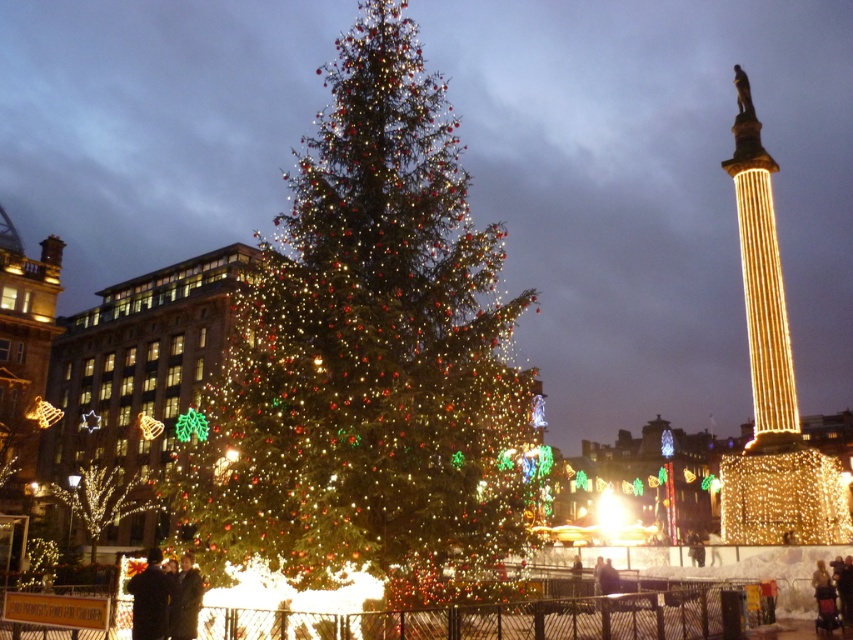
Describe the element at coordinates (366, 353) in the screenshot. I see `green matte christmas tree at center` at that location.

What do you see at coordinates (366, 353) in the screenshot? This screenshot has height=640, width=853. I see `green matte christmas tree at center` at bounding box center [366, 353].

You are a GUI agent. You are given a task and a screenshot of the screen. Output one action in this format:
    pyautogui.click(x=<x>, y=<y>)
    Task: Click on the green matte christmas tree at center
    This screenshot has height=640, width=853.
    Given the screenshot: What is the action you would take?
    pyautogui.click(x=366, y=353)

In the scene shown: Does green matte christmas tree at center have a greater height compared to dark brown coat at lower center?

Yes.

Based on the photo, can you confirm if green matte christmas tree at center is smaller than dark brown coat at lower center?

No, green matte christmas tree at center is not smaller than dark brown coat at lower center.

Is point (181, 516) positioned in front of point (192, 584)?

No, (181, 516) is further to viewer.

You are a GUI agent. You are given a task and a screenshot of the screen. Output one action in this format:
    pyautogui.click(x=<x>, y=<y>)
    Task: Click on the green matte christmas tree at center
    This screenshot has height=640, width=853.
    Given the screenshot: What is the action you would take?
    pyautogui.click(x=366, y=353)

Between dark wool coat at lower left and dark brown coat at lower center, which one has more height?

dark wool coat at lower left is taller.

Who is lower down, dark wool coat at lower left or dark brown coat at lower center?

dark brown coat at lower center

Is point (157, 556) closer to viewer compared to point (200, 586)?

No.

You are a GUI agent. You are given a task and a screenshot of the screen. Output one action in this format:
    pyautogui.click(x=<x>, y=<y>)
    Task: Click on the dark wool coat at lower left
    The image size is (853, 640).
    Given the screenshot: What is the action you would take?
    pyautogui.click(x=149, y=598)